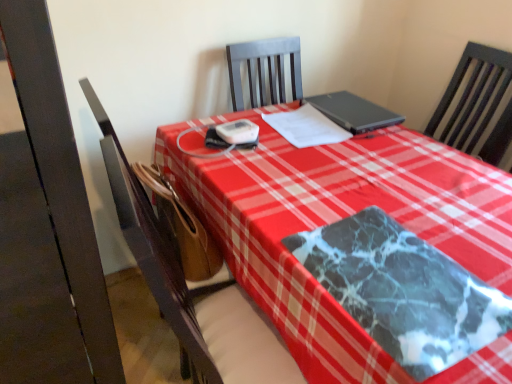
Question: Considering the relative sizes of brown leather chair at center and marble-patterned blanket at center in the image provided, is brown leather chair at center taller than marble-patterned blanket at center?

Choices:
 (A) yes
 (B) no

Answer: (A)

Question: Is brown leather chair at center thinner than marble-patterned blanket at center?

Choices:
 (A) no
 (B) yes

Answer: (A)

Question: Is brown leather chair at center with marble-patterned blanket at center?

Choices:
 (A) no
 (B) yes

Answer: (A)

Question: Is brown leather chair at center oriented towards marble-patterned blanket at center?

Choices:
 (A) yes
 (B) no

Answer: (B)

Question: Is brown leather chair at center at the left side of marble-patterned blanket at center?

Choices:
 (A) yes
 (B) no

Answer: (A)

Question: Considering the positions of white paper at center and brown leather chair at center in the image, is white paper at center bigger or smaller than brown leather chair at center?

Choices:
 (A) small
 (B) big

Answer: (A)

Question: In terms of height, does white paper at center look taller or shorter compared to brown leather chair at center?

Choices:
 (A) short
 (B) tall

Answer: (A)

Question: Is point (306, 144) closer or farther from the camera than point (211, 263)?

Choices:
 (A) closer
 (B) farther

Answer: (B)

Question: Which is correct: white paper at center is inside brown leather chair at center, or outside of it?

Choices:
 (A) inside
 (B) outside

Answer: (B)

Question: From the image's perspective, is white paper at center located above or below black matte laptop at center?

Choices:
 (A) above
 (B) below

Answer: (B)

Question: Visually, is white paper at center positioned to the left or to the right of black matte laptop at center?

Choices:
 (A) right
 (B) left

Answer: (B)

Question: From a real-world perspective, is white paper at center above or below black matte laptop at center?

Choices:
 (A) above
 (B) below

Answer: (B)

Question: Would you say white paper at center is inside or outside black matte laptop at center?

Choices:
 (A) outside
 (B) inside

Answer: (A)

Question: Visually, is black matte laptop at center positioned to the left or to the right of white paper at center?

Choices:
 (A) left
 (B) right

Answer: (B)

Question: Considering their positions, is black matte laptop at center located in front of or behind white paper at center?

Choices:
 (A) front
 (B) behind

Answer: (B)